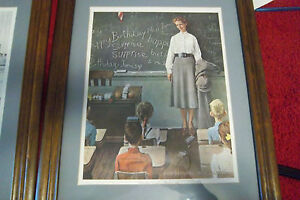
You are a GUI agent. You are given a task and a screenshot of the screen. Output one action in this format:
    pyautogui.click(x=<x>, y=<y>)
    Task: Click on the heads in painting
    
    Given the screenshot: What is the action you would take?
    pyautogui.click(x=141, y=107), pyautogui.click(x=221, y=108), pyautogui.click(x=224, y=127), pyautogui.click(x=133, y=131), pyautogui.click(x=182, y=24), pyautogui.click(x=88, y=108)